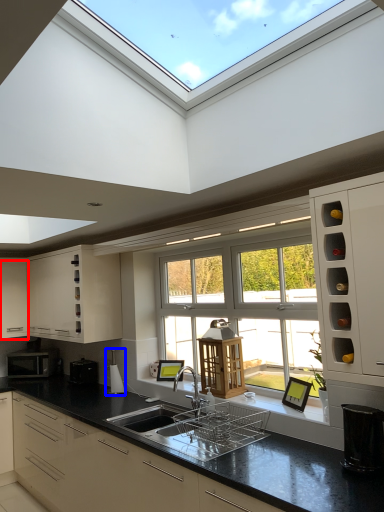
Question: Among these objects, which one is farthest to the camera, cabinetry (highlighted by a red box) or appliance (highlighted by a blue box)?

Choices:
 (A) cabinetry
 (B) appliance

Answer: (A)